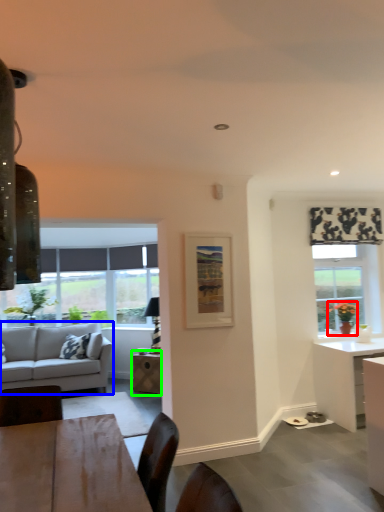
Question: Based on their relative distances, which object is farther from houseplant (highlighted by a red box)? Choose from studio couch (highlighted by a blue box) and table (highlighted by a green box).

Choices:
 (A) studio couch
 (B) table

Answer: (A)